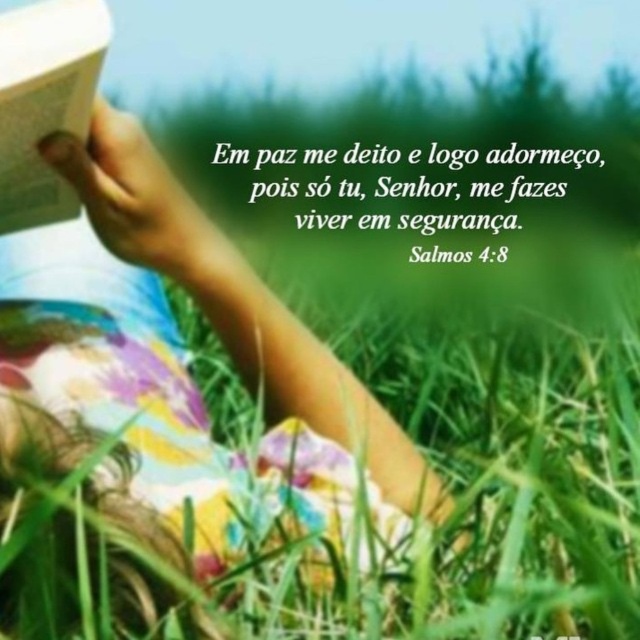
Is pastel floral dress at center smaller than white paper book at upper left?

No.

What do you see at coordinates (177, 362) in the screenshot?
I see `pastel floral dress at center` at bounding box center [177, 362].

Locate an element on the screen. The image size is (640, 640). pastel floral dress at center is located at coordinates (177, 362).

Between pastel floral dress at center and green leafy text at center, which one is positioned lower?

Positioned lower is pastel floral dress at center.

In order to click on pastel floral dress at center in this screenshot , I will do `click(177, 362)`.

You are a GUI agent. You are given a task and a screenshot of the screen. Output one action in this format:
    pyautogui.click(x=<x>, y=<y>)
    Task: Click on the pastel floral dress at center
    
    Given the screenshot: What is the action you would take?
    pyautogui.click(x=177, y=362)

Does green leafy text at center have a smaller size compared to white paper book at upper left?

No.

Is green leafy text at center positioned at the back of white paper book at upper left?

Yes, green leafy text at center is further from the viewer.

Does point (400, 205) come farther from viewer compared to point (28, 176)?

Yes.

Where is `green leafy text at center`? green leafy text at center is located at coordinates (410, 202).